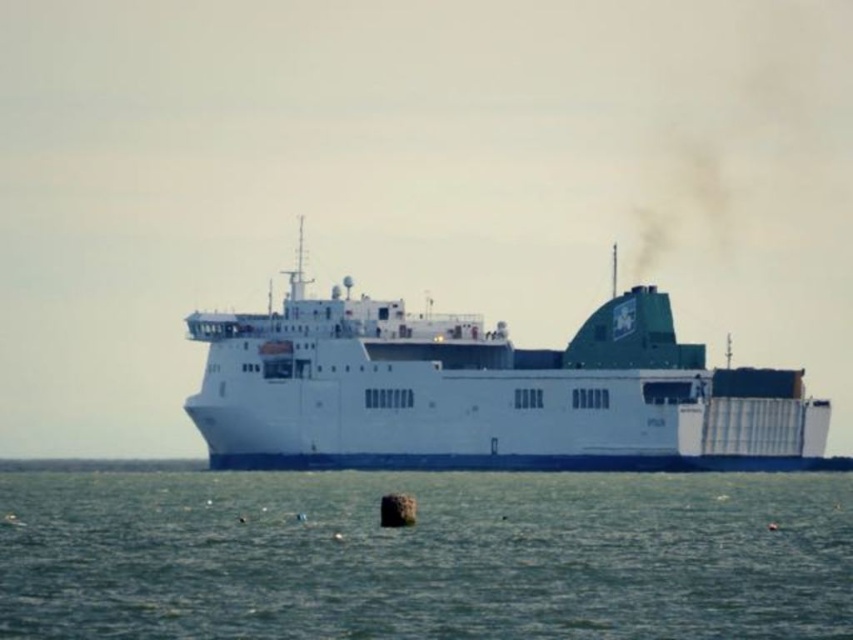
Which of these two, greenish-blue water at center or white matte ship at center, stands shorter?

greenish-blue water at center

Can you confirm if greenish-blue water at center is taller than white matte ship at center?

No.

Which is behind, point (57, 554) or point (258, 346)?

The point (258, 346) is behind.

Where is `greenish-blue water at center`? The width and height of the screenshot is (853, 640). greenish-blue water at center is located at coordinates (425, 556).